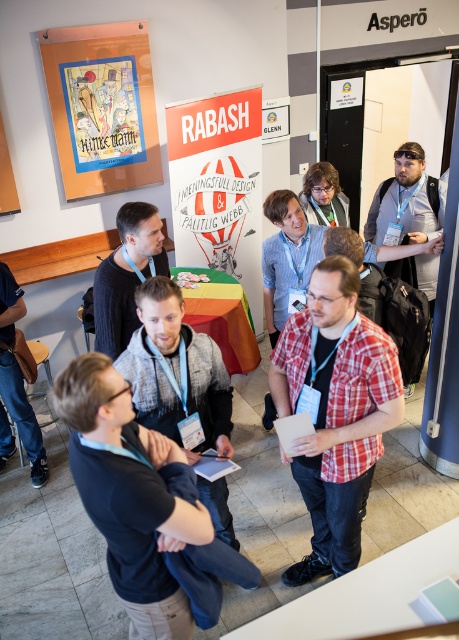
You are organizing a photo shoot and need to ensure that the red plaid shirt at center and the white paperboard at center are both visible in the frame. Given their sizes, which object should you prioritize positioning closer to the camera to ensure it doesn

The red plaid shirt at center has a smaller width than the white paperboard at center. To ensure both are visible, prioritize positioning the red plaid shirt at center closer to the camera since it is smaller and might be less noticeable if placed farther back.

You are standing at the entrance of the conference room. You need to locate the white paperboard at center. According to the coordinates provided, in which direction should you move to reach it?

The white paperboard at center is located at coordinates point (x=218, y=184), so you should move towards the center of the room to reach it.

You are standing at the point marked as point (335, 412). What is the color of the shirt worn by the person at the center of the image?

The red plaid shirt at center is located at point (335, 412), so the person there is wearing a red plaid shirt.